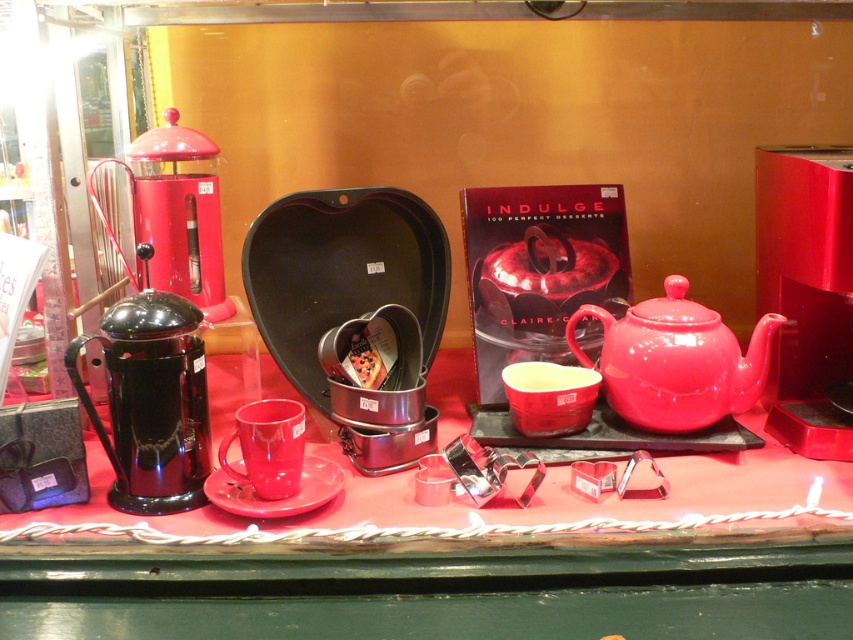
Question: Which object appears closest to the camera in this image?

Choices:
 (A) matte ceramic saucer at center
 (B) matte ceramic teapot at center-right

Answer: (A)

Question: Does glossy plastic coffee machine at center appear on the right side of matte ceramic teapot at center-right?

Choices:
 (A) yes
 (B) no

Answer: (A)

Question: Estimate the real-world distances between objects in this image. Which object is closer to the glossy ceramic table at center?

Choices:
 (A) glossy ceramic mug at center
 (B) black glossy coffee pot at left
 (C) matte glass coffee pot at left
 (D) matte ceramic saucer at center

Answer: (D)

Question: Which point is closer to the camera?

Choices:
 (A) matte ceramic teapot at center-right
 (B) glossy ceramic mug at center
 (C) black glossy coffee pot at left
 (D) glossy plastic coffee machine at center

Answer: (C)

Question: Does black glossy coffee pot at left have a larger size compared to glossy ceramic mug at center?

Choices:
 (A) yes
 (B) no

Answer: (A)

Question: Does matte ceramic teapot at center-right have a smaller size compared to glossy ceramic mug at center?

Choices:
 (A) yes
 (B) no

Answer: (B)